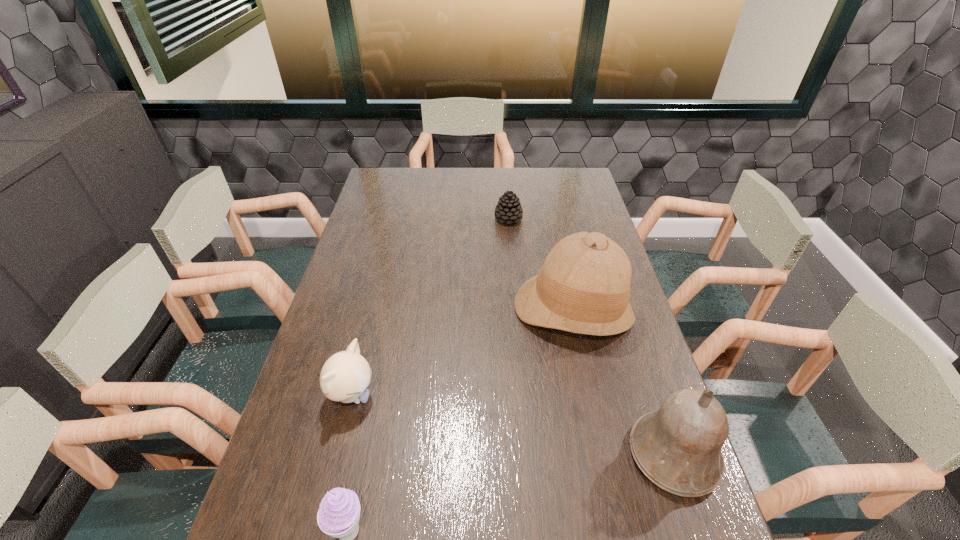
You are a GUI agent. You are given a task and a screenshot of the screen. Output one action in this format:
    pyautogui.click(x=<x>, y=<y>)
    Task: Click on the free space located on the face of the kitten
    The width and height of the screenshot is (960, 540).
    Given the screenshot: What is the action you would take?
    pyautogui.click(x=498, y=457)

Locate an element on the screen. Image resolution: width=960 pixels, height=540 pixels. vacant region located 0.120m on the face of the kitten is located at coordinates (414, 421).

I want to click on vacant space located on the face of the kitten, so click(491, 454).

Locate an element on the screen. This screenshot has height=540, width=960. vacant space positioned 0.140m on the front-facing side of the second farthest object is located at coordinates (559, 388).

This screenshot has width=960, height=540. I want to click on free point located 0.210m on the front-facing side of the second farthest object, so click(x=556, y=411).

At what (x,y) coordinates should I click in order to perform the action: click on free space located on the front-facing side of the second farthest object. Please return your answer as a coordinate pair (x, y). Looking at the image, I should click on (560, 381).

In order to click on object located at the near edge in this screenshot , I will do `click(678, 448)`.

In order to click on object present at the left edge in this screenshot , I will do `click(345, 376)`.

At what (x,y) coordinates should I click in order to perform the action: click on bell located at the right edge. Please return your answer as a coordinate pair (x, y). This screenshot has width=960, height=540. Looking at the image, I should click on coord(678,448).

I want to click on hat at the right edge, so click(583, 287).